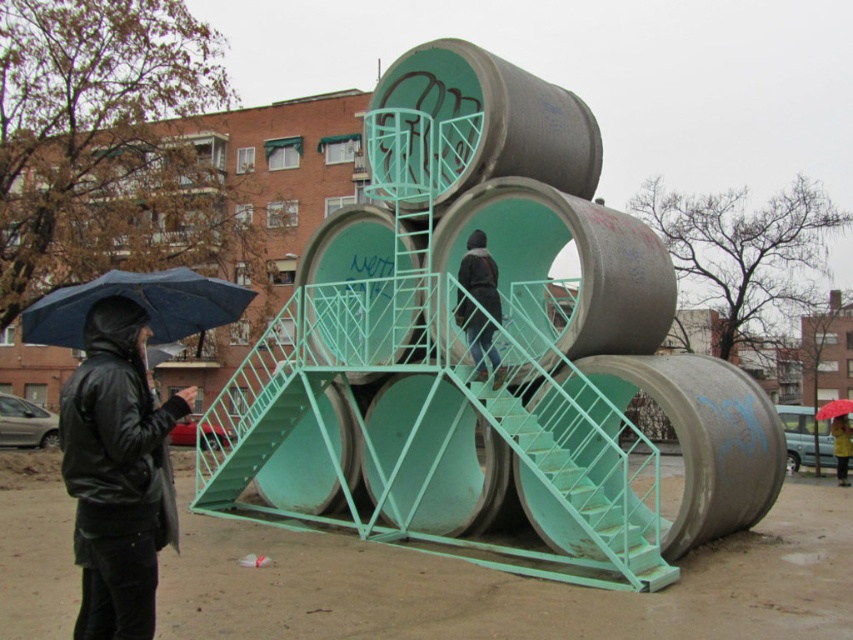
Looking at this image, who is shorter, concrete textured barrel at center or black leather jacket at left?

Standing shorter between the two is black leather jacket at left.

This screenshot has height=640, width=853. What are the coordinates of `concrete textured barrel at center` in the screenshot? It's located at (495, 348).

Is point (743, 371) more distant than point (840, 440)?

No.

What are the coordinates of `concrete textured barrel at center` in the screenshot? It's located at (495, 348).

Can you confirm if yellow matte jacket at upper center is thinner than red matte umbrella at upper right?

Yes.

At what (x,y) coordinates should I click in order to perform the action: click on yellow matte jacket at upper center. Please return your answer as a coordinate pair (x, y). Looking at the image, I should click on (840, 445).

Identify the location of yellow matte jacket at upper center. (840, 445).